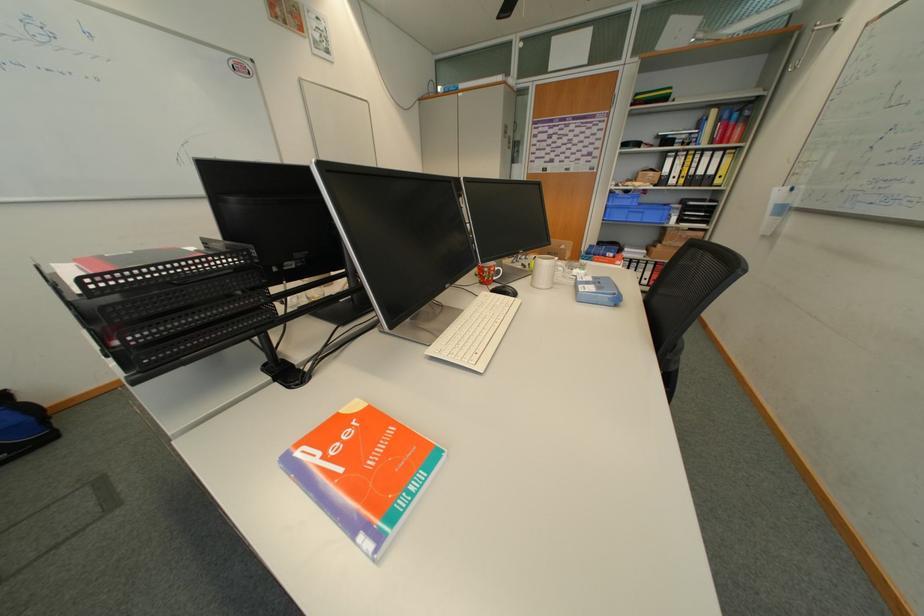
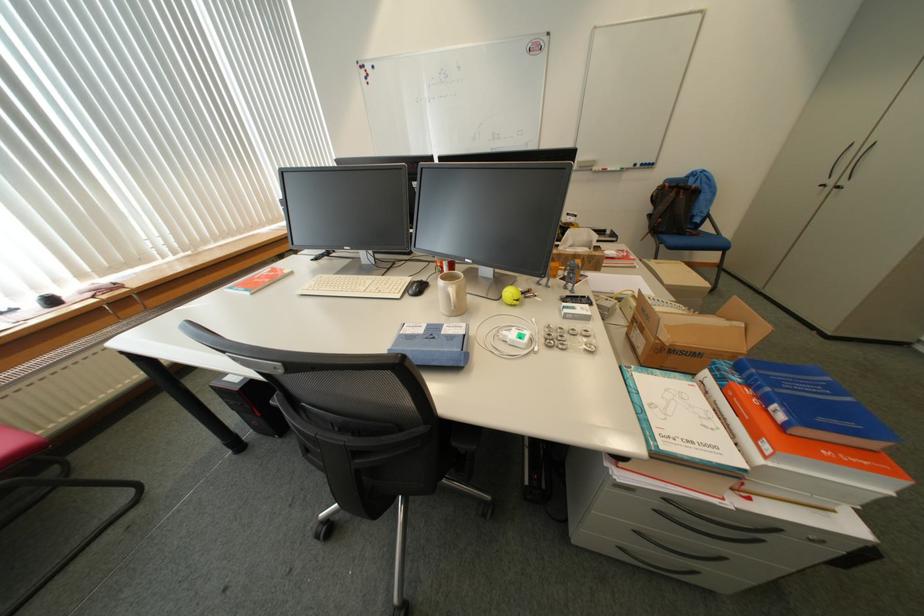
Locate, in the second image, the point that corresponds to the point at 622,256 in the first image.

(791, 418)